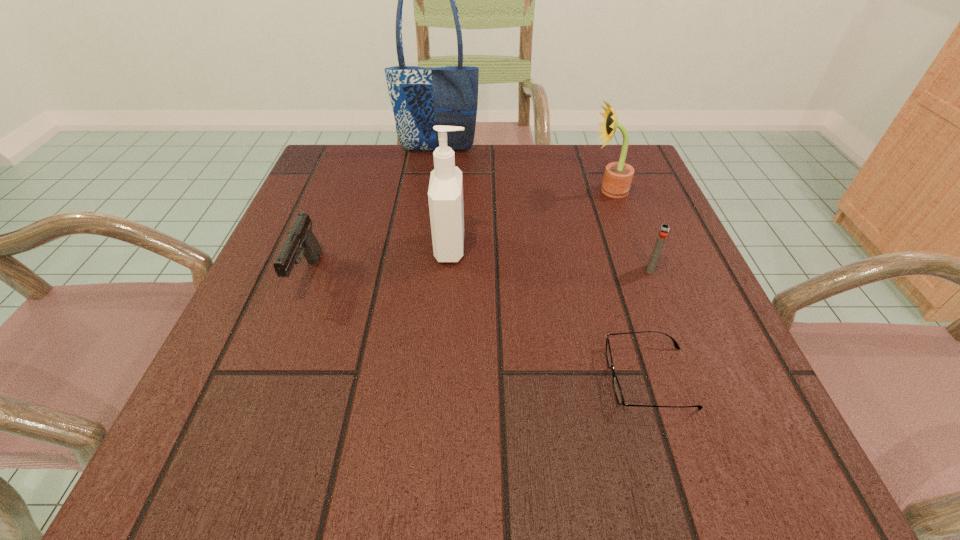
The image size is (960, 540). Identify the location of sunflower that is at the far edge. (618, 176).

Find the location of a particular element. The width and height of the screenshot is (960, 540). object present at the near edge is located at coordinates (616, 386).

You are a GUI agent. You are given a task and a screenshot of the screen. Output one action in this format:
    pyautogui.click(x=<x>, y=<y>)
    Task: Click on the object present at the left edge
    
    Given the screenshot: What is the action you would take?
    pyautogui.click(x=300, y=241)

Find the location of a particular element. Image resolution: width=960 pixels, height=540 pixels. sunflower that is at the right edge is located at coordinates (618, 176).

Where is `igniter positioned at the right edge`? This screenshot has width=960, height=540. igniter positioned at the right edge is located at coordinates (663, 232).

Where is `spectacles positioned at the right edge`? spectacles positioned at the right edge is located at coordinates (616, 386).

Identify the location of object positioned at the far right corner. (618, 176).

Identify the location of object situated at the near right corner. (616, 386).

Identify the location of free space at the far edge of the desktop. (542, 181).

Where is `vacant space at the near edge of the desktop`? Image resolution: width=960 pixels, height=540 pixels. vacant space at the near edge of the desktop is located at coordinates (577, 451).